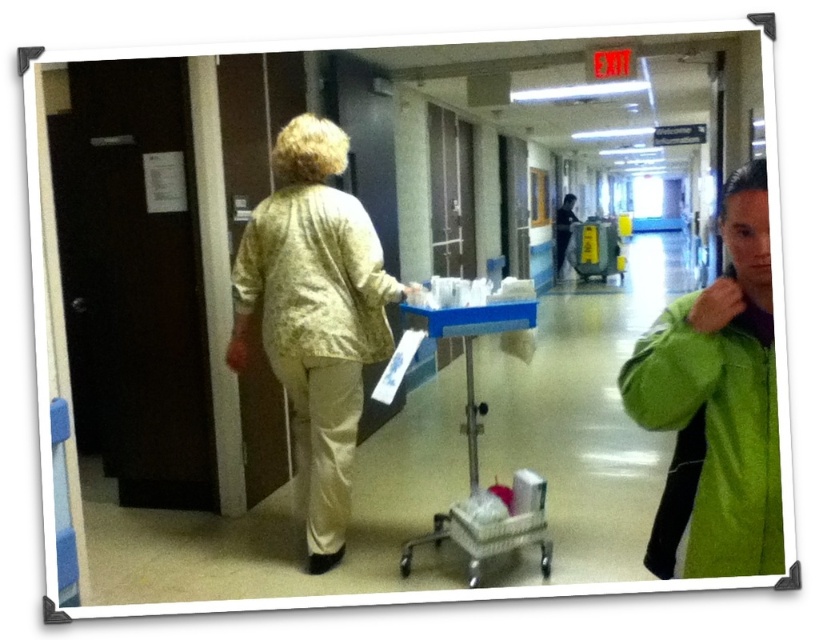
You are a delivery person who needs to place a package between the green fleece jacket at right and the fluffy beige jacket at center in the hallway. The package is 1.5 meters long. Will it fit between them?

The distance between the green fleece jacket at right and the fluffy beige jacket at center is 1.53 meters. Since the package is 1.5 meters long, it will fit with a small amount of space remaining.

You are a hospital staff member who needs to determine which jacket is larger between the floral fabric jacket at center and the fluffy beige jacket at center. Based on the scene, which one is bigger?

The floral fabric jacket at center is bigger than the fluffy beige jacket at center.

Consider the image. What is the 2D coordinate of the floral fabric jacket at center in the image?

The 2D coordinate of the floral fabric jacket at center is at point (x=315, y=316).